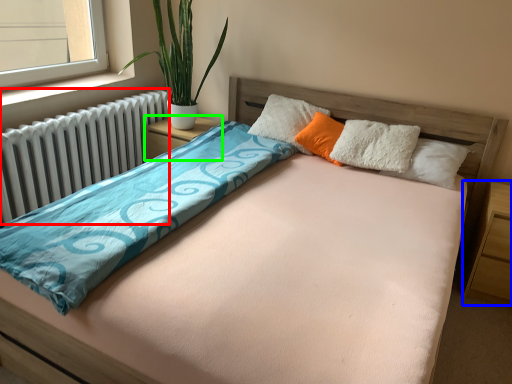
Question: Which is nearer to the radiator (highlighted by a red box)? nightstand (highlighted by a blue box) or nightstand (highlighted by a green box).

Choices:
 (A) nightstand
 (B) nightstand

Answer: (B)